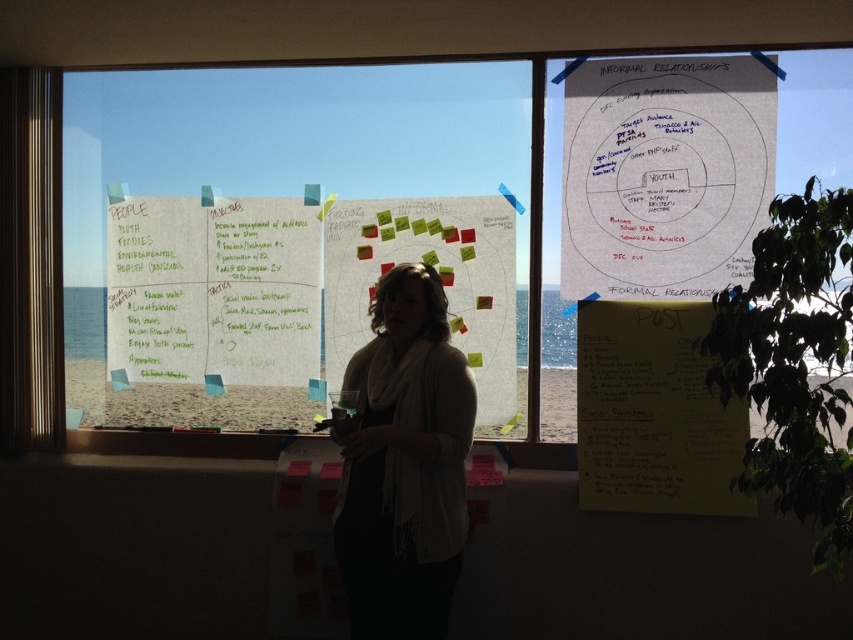
You are a presenter standing in front of the window with two white papers. The first is at the upper right labeled as the white paper at upper right, and the second is at the center with sticky notes called white paper with sticky notes at center. You need to point to the one closer to you. Which one should you point to?

The white paper at upper right is 22.73 inches away from the white paper with sticky notes at center. Since you are standing in front of the window, the white paper with sticky notes at center is closer to you, so you should point to the white paper with sticky notes at center.

You are an interior designer analyzing the layout of this room. The transparent glass window at center and the green paperboard at center are both at the center. Which one is positioned to the right?

The transparent glass window at center is positioned to the right of the green paperboard at center.